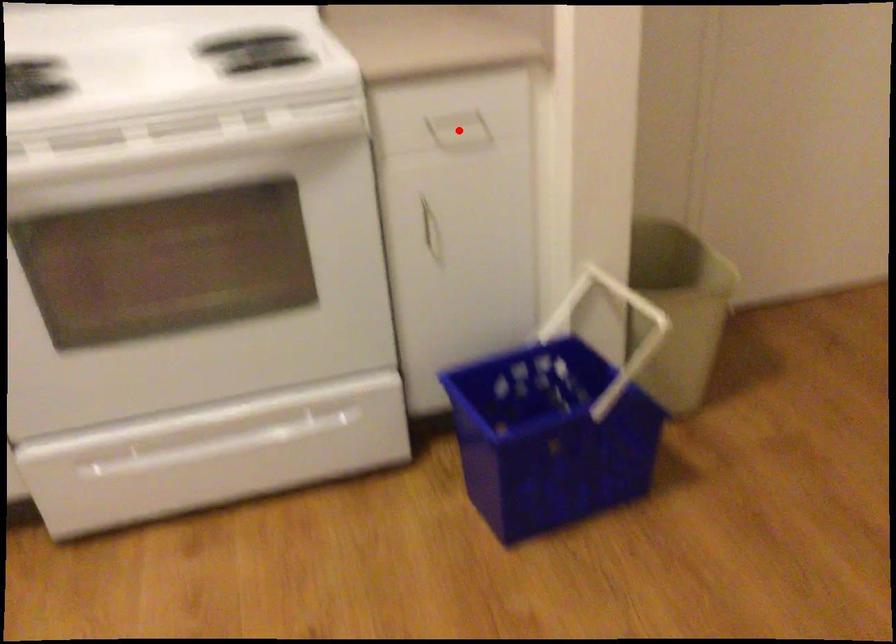
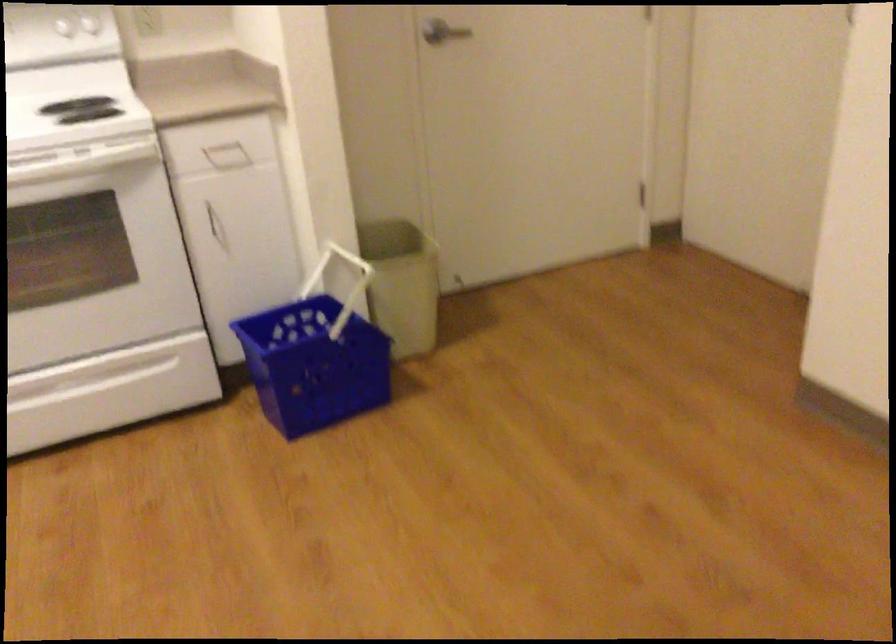
Question: I am providing you with two images of the same scene from different viewpoints. Given a red point in image1, look at the same physical point in image2. Is it:

Choices:
 (A) Closer to the viewpoint
 (B) Farther from the viewpoint

Answer: (B)